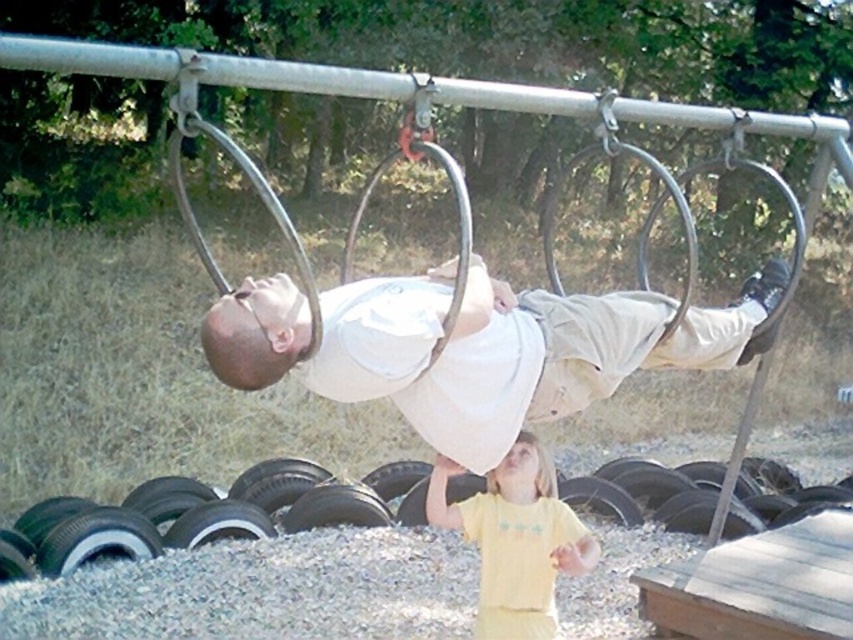
Question: Can you confirm if black rubber tire at lower center is positioned to the left of yellow cotton shirt at lower center?

Choices:
 (A) no
 (B) yes

Answer: (B)

Question: Which is farther from the black rubber tire at lower center?

Choices:
 (A) white cotton shirt at center
 (B) yellow cotton shirt at lower center

Answer: (A)

Question: Can you confirm if black rubber tire at lower center is positioned to the right of yellow cotton shirt at lower center?

Choices:
 (A) yes
 (B) no

Answer: (B)

Question: Considering the real-world distances, which object is closest to the white cotton shirt at center?

Choices:
 (A) yellow cotton shirt at lower center
 (B) black rubber tire at lower center

Answer: (A)

Question: Does white cotton shirt at center come in front of yellow cotton shirt at lower center?

Choices:
 (A) no
 (B) yes

Answer: (B)

Question: Among these objects, which one is farthest from the camera?

Choices:
 (A) black rubber tire at lower center
 (B) yellow cotton shirt at lower center

Answer: (A)